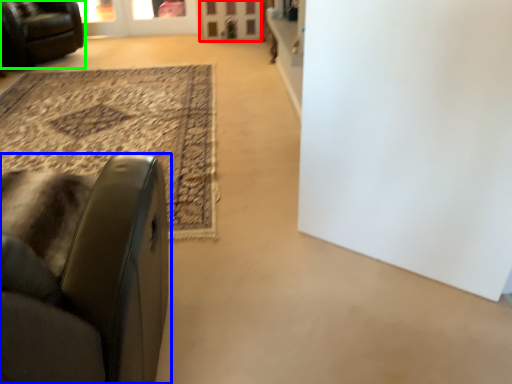
Question: Considering the real-world distances, which object is closest to screen door (highlighted by a red box)? chair (highlighted by a blue box) or chair (highlighted by a green box).

Choices:
 (A) chair
 (B) chair

Answer: (B)